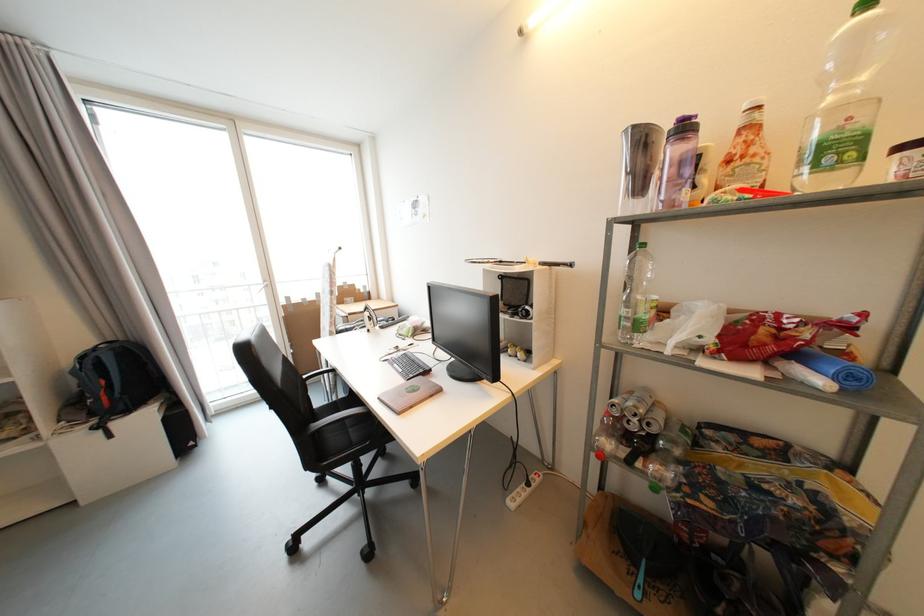
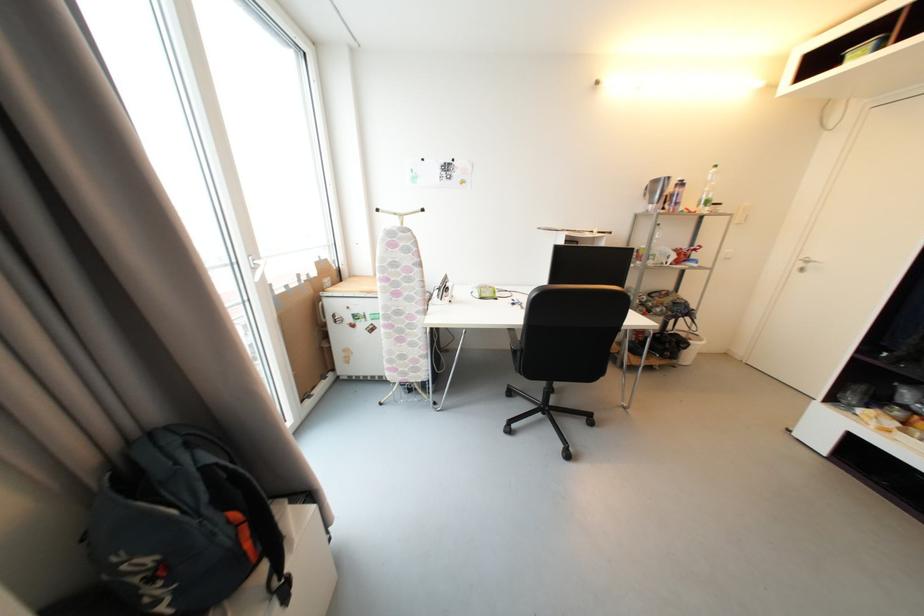
Where in the second image is the point corresponding to [110,400] from the first image?

(253, 546)